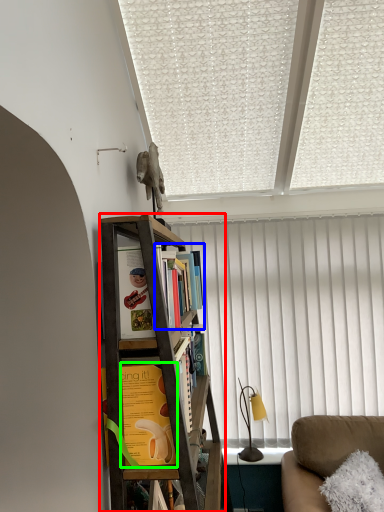
Question: Which object is the closest to the bookcase (highlighted by a red box)? Choose among these: book (highlighted by a blue box) or book (highlighted by a green box).

Choices:
 (A) book
 (B) book

Answer: (B)